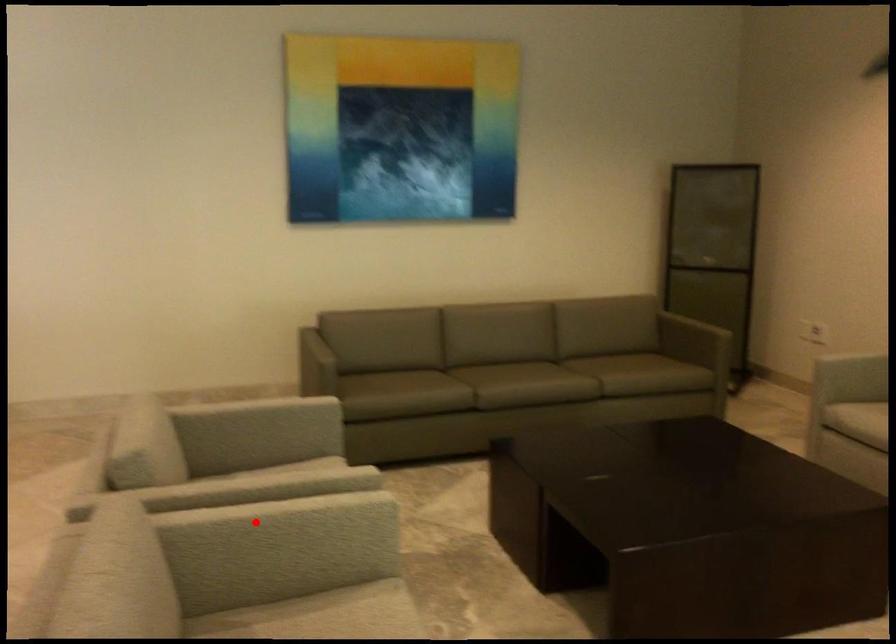
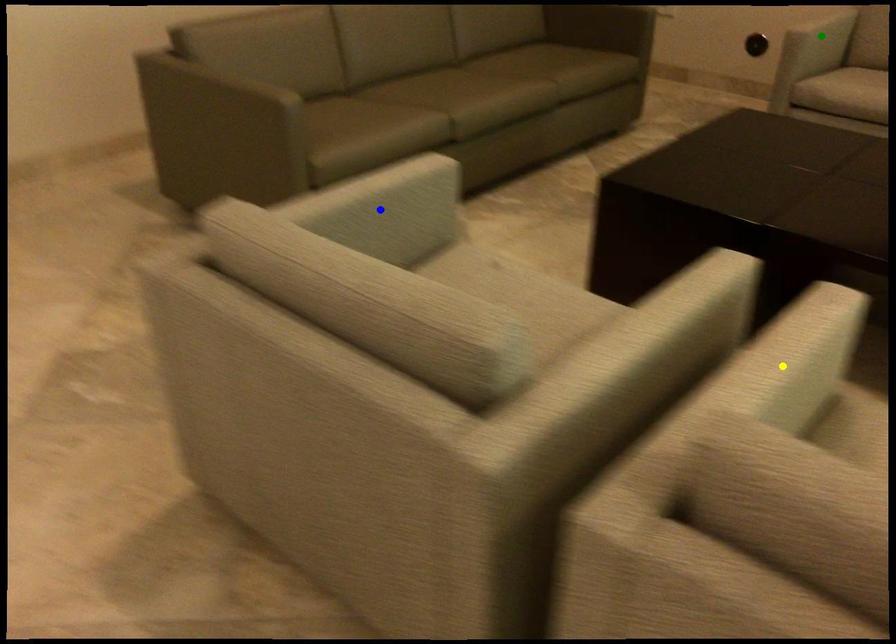
Question: I am providing you with two images of the same scene from different viewpoints. A red point is marked on the first image. You are given multiple points on the second image. Which point in image 2 is actually the same real-world point as the red point in image 1?

Choices:
 (A) blue point
 (B) green point
 (C) yellow point

Answer: (C)